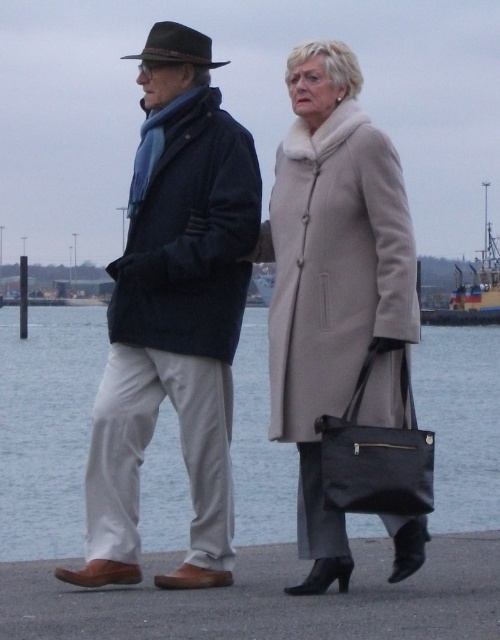
You are a fashion designer observing the waterfront scene. You notice the velvet blue scarf at left and the metallic gray boat at center. Which object would you consider larger in size?

The velvet blue scarf at left is bigger than the metallic gray boat at center.

You are a photographer standing on the waterfront promenade. You want to capture a photo of the clear water at lower center and the metallic gray boat at center. Which object should you focus on first if you want to ensure both are in the frame without moving the camera?

The clear water at lower center is shorter than the metallic gray boat at center, so you should focus on the metallic gray boat at center first to ensure it stays within the frame as you adjust the camera angle.

You are standing on the waterfront promenade and want to take a photo of the clear water at lower center. Where should you point your camera to capture it?

You should point your camera to the coordinates point at [46,428] to capture the clear water at lower center.